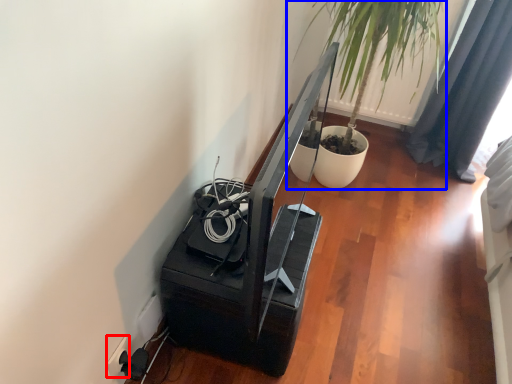
Question: Which of the following is the farthest to the observer, electric outlet (highlighted by a red box) or houseplant (highlighted by a blue box)?

Choices:
 (A) electric outlet
 (B) houseplant

Answer: (B)